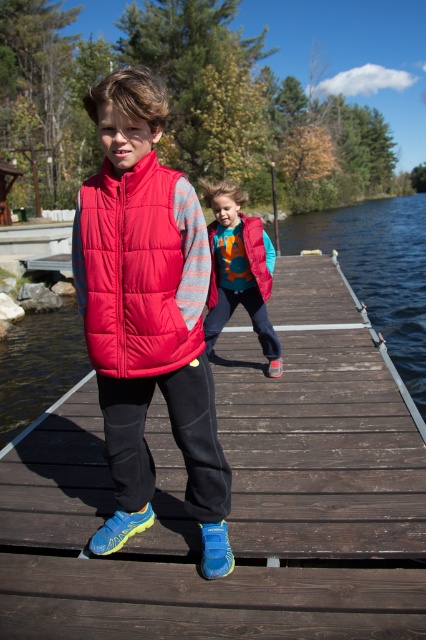
Does transparent water at center have a smaller size compared to transparent water at dock right?

Indeed, transparent water at center has a smaller size compared to transparent water at dock right.

Which is behind, point (20, 355) or point (373, 227)?

Point (373, 227)

Where is `transparent water at center`? This screenshot has height=640, width=426. transparent water at center is located at coordinates (377, 269).

Find the location of `transparent water at center`. transparent water at center is located at coordinates (377, 269).

Can you confirm if transparent water at center is shorter than matte orange vest at center?

In fact, transparent water at center may be taller than matte orange vest at center.

Which is in front, point (54, 316) or point (213, 253)?

Positioned in front is point (213, 253).

Does point (370, 289) lie behind point (229, 284)?

Yes, it is behind point (229, 284).

I want to click on transparent water at center, so click(377, 269).

Can you confirm if transparent water at center is wider than matte pink vest at center?

Yes.

Can you confirm if transparent water at center is positioned above matte pink vest at center?

Yes, transparent water at center is above matte pink vest at center.

Consider the image. Who is more forward, (42, 365) or (255, 250)?

Positioned in front is point (255, 250).

Where is `transparent water at center`? Image resolution: width=426 pixels, height=640 pixels. transparent water at center is located at coordinates (377, 269).